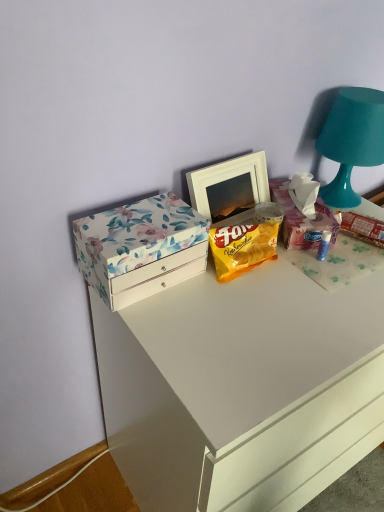
Image resolution: width=384 pixels, height=512 pixels. I want to click on free space in front of floral cardboard box at upper right, so click(x=324, y=270).